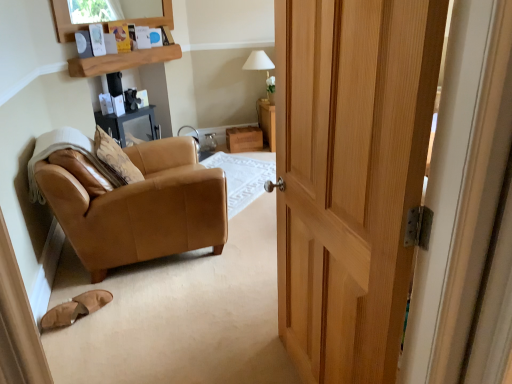
I want to click on free space above wooden shelf at upper center (from a real-world perspective), so click(131, 49).